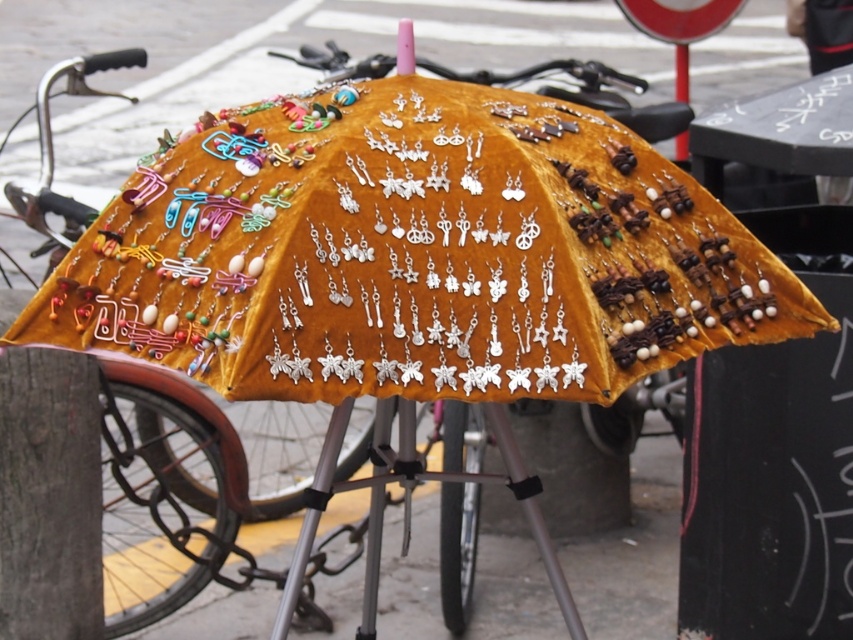
Can you confirm if velvet umbrella at center is smaller than black plastic pole at upper right?

No.

In the scene shown: Can you confirm if velvet umbrella at center is positioned below black plastic pole at upper right?

Indeed, velvet umbrella at center is positioned under black plastic pole at upper right.

Is point (579, 339) positioned behind point (685, 49)?

That is False.

You are a GUI agent. You are given a task and a screenshot of the screen. Output one action in this format:
    pyautogui.click(x=<x>, y=<y>)
    Task: Click on the velvet umbrella at center
    This screenshot has width=853, height=640.
    Given the screenshot: What is the action you would take?
    pyautogui.click(x=415, y=253)